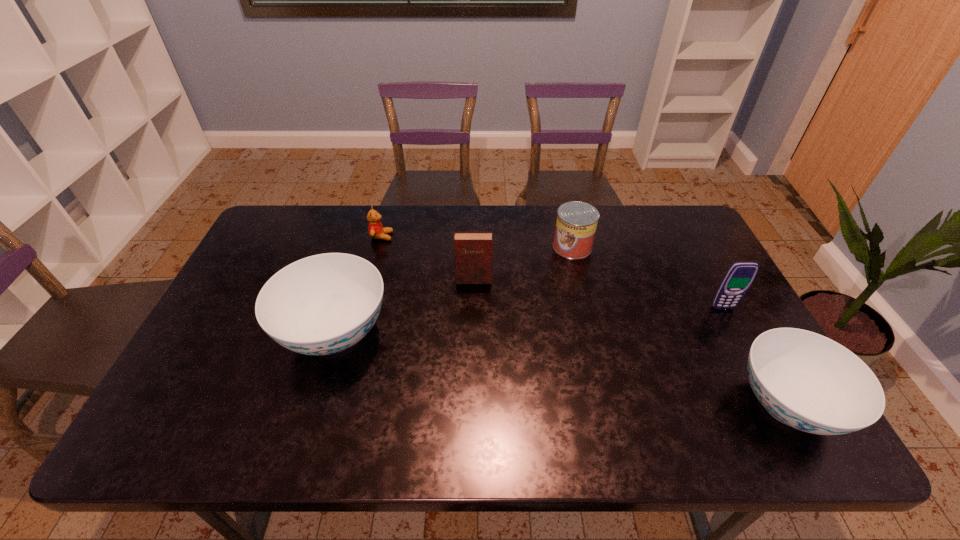
Locate an element on the screen. free region at the left edge is located at coordinates (295, 256).

The width and height of the screenshot is (960, 540). I want to click on free region at the right edge of the desktop, so pos(745,353).

The height and width of the screenshot is (540, 960). Find the location of `vacant region at the far left corner`. vacant region at the far left corner is located at coordinates (256, 241).

This screenshot has height=540, width=960. I want to click on vacant space at the near left corner of the desktop, so click(x=198, y=379).

Locate an element on the screen. vacant region at the far right corner is located at coordinates (640, 205).

At what (x,y) coordinates should I click in order to perform the action: click on vacant space that's between the diary and the right chinaware. Please return your answer as a coordinate pair (x, y). The image size is (960, 540). Looking at the image, I should click on (631, 342).

Identify the location of vacant area that lies between the shortest object and the cellular telephone. (552, 272).

Where is `free space that is in between the teddy bear and the right chinaware`? free space that is in between the teddy bear and the right chinaware is located at coordinates (585, 321).

Where is `empty space that is in between the diary and the cellular telephone`? empty space that is in between the diary and the cellular telephone is located at coordinates (598, 294).

You are a GUI agent. You are given a task and a screenshot of the screen. Output one action in this format:
    pyautogui.click(x=<x>, y=<y>)
    Task: Click on the unoccupied position between the fourth nearest object and the can
    
    Given the screenshot: What is the action you would take?
    pyautogui.click(x=523, y=264)